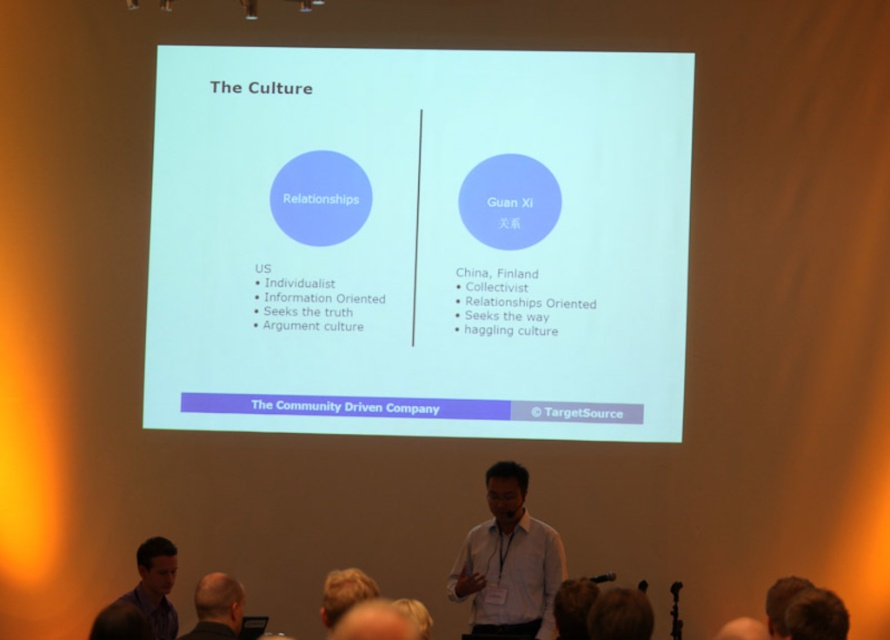
You are sitting in the front row of the presentation. You want to look at the white matte projector screen at center and then quickly glance at the matte black shirt at lower left. Which object will require you to turn your head less? Explain your reasoning based on their positions.

The white matte projector screen at center is further to the viewer than the matte black shirt at lower left. Since the screen is closer to you, you would need to turn your head less to look at it compared to the shirt, which is positioned further back and to the left.

You are organizing a cultural exchange event and need to decide which shirt to wear based on the presentation slide displayed. The slide compares cultural traits between the US and China, Finland. The white matte shirt at center represents US values, and the matte black shirt at lower left represents China, Finland values. Which shirt has a wider width?

The white matte shirt at center has a greater width than the matte black shirt at lower left according to the description.

In the presentation about cultural differences between the US and China, Finland, there is a point marked at coordinates (418, 243). Where exactly is this point located on the screen?

The point is located on the white matte projector screen at center.